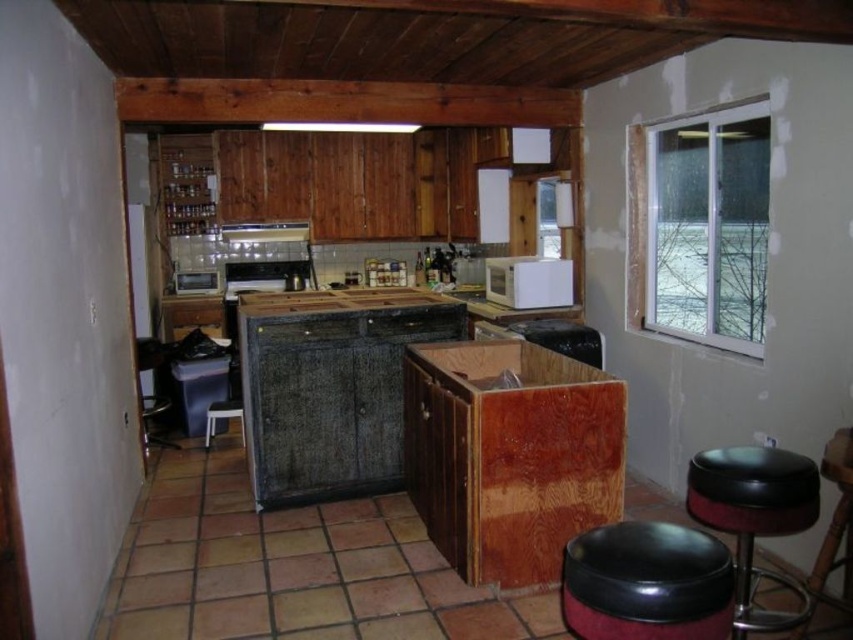
You are standing in the kitchen and want to reach both the point at coordinates (x=711, y=477) and the point at (x=207, y=428). Which point will you reach first as you move forward?

You will reach the point at coordinates (x=711, y=477) first because it is closer to you than the point at (x=207, y=428).

You are standing in the kitchen and see two points marked on the floor. The first point is at coordinates point (376, 292) and the second is at point (213, 403). Which point is closer to you?

Point (376, 292) is in front of point (213, 403), so it is closer to you.